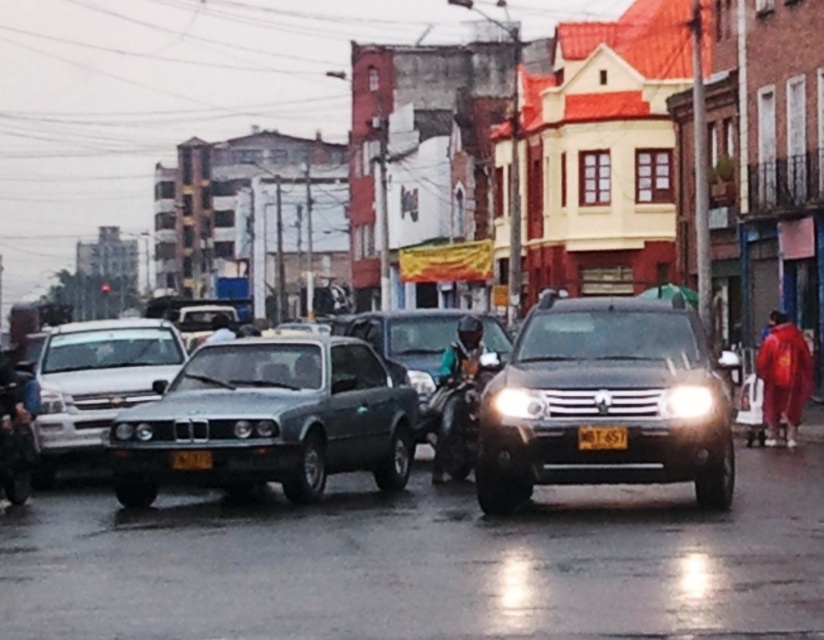
You are a delivery driver who needs to attach a GPS tracker to the metallic silver motorcycle at lower left and the yellow matte license plate at center. Which object requires a larger GPS tracker?

The metallic silver motorcycle at lower left requires a larger GPS tracker because it is bigger than the yellow matte license plate at center.